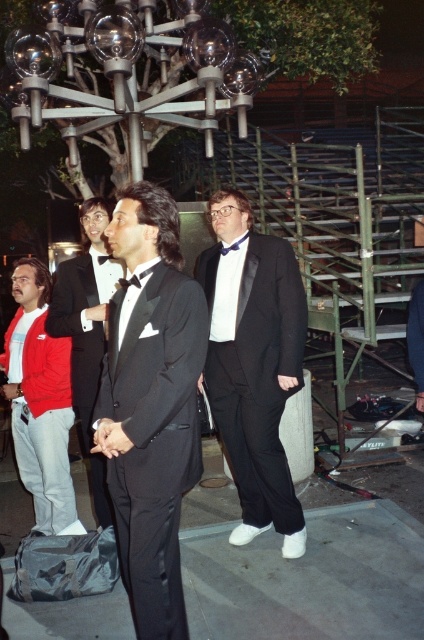
Question: Is black satin tuxedo at center smaller than shiny black tuxedo at center?

Choices:
 (A) no
 (B) yes

Answer: (B)

Question: Can you confirm if black satin tuxedo at center is wider than red cotton jacket at left?

Choices:
 (A) yes
 (B) no

Answer: (B)

Question: Considering the real-world distances, which object is farthest from the red cotton jacket at left?

Choices:
 (A) matte black suit at center
 (B) black satin tuxedo at center

Answer: (B)

Question: Which object appears closest to the camera in this image?

Choices:
 (A) matte black suit at center
 (B) shiny black tuxedo at center
 (C) black satin tuxedo at center
 (D) red cotton jacket at left

Answer: (C)

Question: Is matte black suit at center closer to the viewer compared to shiny black tuxedo at center?

Choices:
 (A) yes
 (B) no

Answer: (B)

Question: Which point is farther to the camera?

Choices:
 (A) (89, 284)
 (B) (55, 413)
 (C) (234, 403)

Answer: (B)